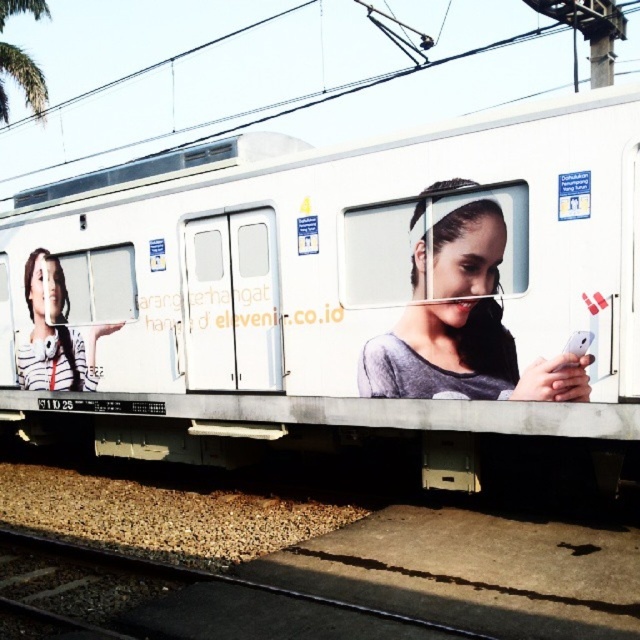
Question: Is white matte train at center positioned before black asphalt train track at lower center?

Choices:
 (A) yes
 (B) no

Answer: (B)

Question: Considering the real-world distances, which object is farthest from the matte gray phone at center?

Choices:
 (A) black asphalt train track at lower center
 (B) striped fabric shirt at left
 (C) white matte train at center

Answer: (B)

Question: Which object appears closest to the camera in this image?

Choices:
 (A) black asphalt train track at lower center
 (B) white matte train at center

Answer: (A)

Question: Does matte gray phone at center have a smaller size compared to black asphalt train track at lower center?

Choices:
 (A) yes
 (B) no

Answer: (B)

Question: In this image, where is white matte train at center located relative to black asphalt train track at lower center?

Choices:
 (A) right
 (B) left

Answer: (A)

Question: Which of these objects is positioned closest to the black asphalt train track at lower center?

Choices:
 (A) white matte train at center
 (B) matte gray phone at center

Answer: (A)